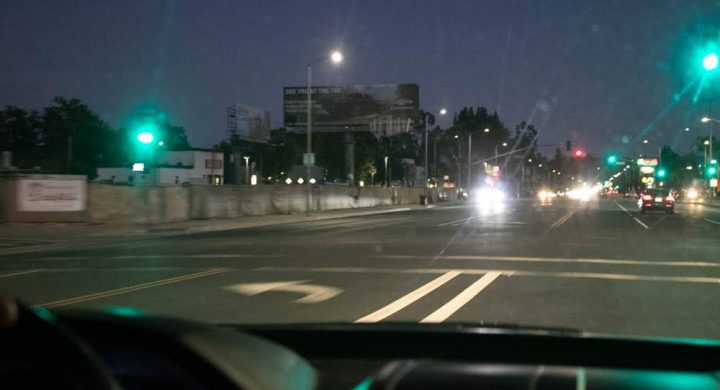
Find the location of a particular element. The width and height of the screenshot is (720, 390). light is located at coordinates (441, 109).